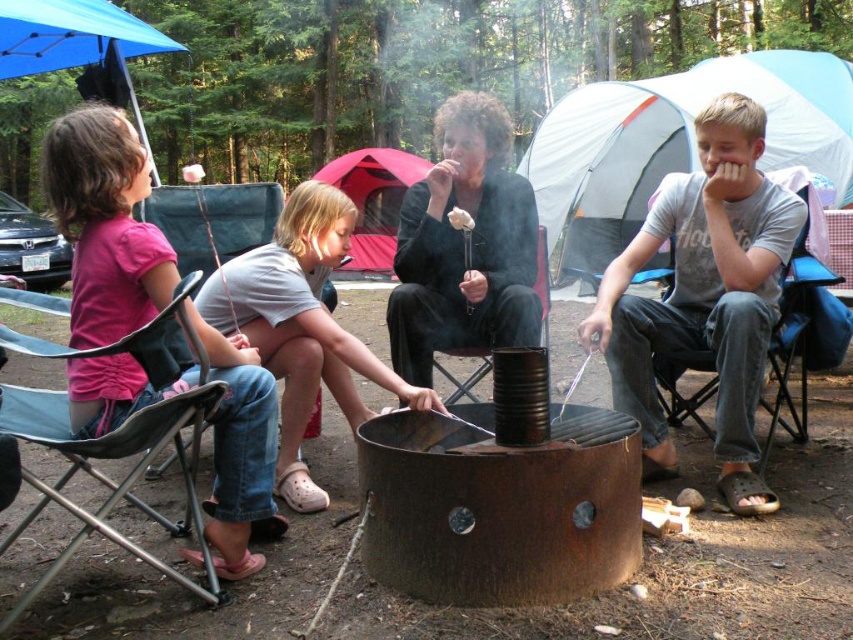
Question: Which point is closer to the camera?

Choices:
 (A) (781, 268)
 (B) (297, 376)
 (C) (511, 209)

Answer: (B)

Question: Among these objects, which one is farthest from the camera?

Choices:
 (A) black fabric chair at right
 (B) blue fabric umbrella at upper left
 (C) pink fabric shirt at left
 (D) gray cotton t-shirt at right

Answer: (B)

Question: Does white fabric tent at upper right have a larger size compared to blue fabric chair at left?

Choices:
 (A) no
 (B) yes

Answer: (B)

Question: Which object is farther from the camera taking this photo?

Choices:
 (A) gray cotton t-shirt at right
 (B) blue fabric umbrella at upper left
 (C) black fabric chair at right
 (D) matte black jacket at center

Answer: (B)

Question: Is pink fabric shirt at left positioned in front of blue fabric chair at left?

Choices:
 (A) no
 (B) yes

Answer: (B)

Question: Does pink fabric shirt at left lie in front of white croc shoes at lower left?

Choices:
 (A) yes
 (B) no

Answer: (A)